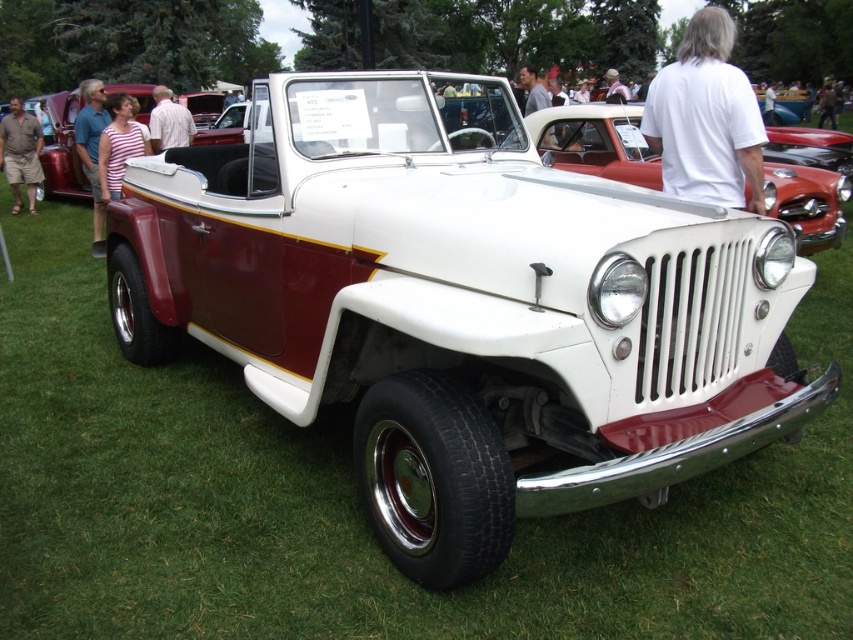
Measure the distance between point (749, 172) and camera.

Point (749, 172) and camera are 14.17 feet apart.

Between white cotton shirt at upper right and brown shorts at lower left, which one has more height?

Standing taller between the two is brown shorts at lower left.

At what (x,y) coordinates should I click in order to perform the action: click on white cotton shirt at upper right. Please return your answer as a coordinate pair (x, y). Looking at the image, I should click on (706, 118).

This screenshot has height=640, width=853. In order to click on white cotton shirt at upper right in this screenshot , I will do `click(706, 118)`.

Who is lower down, brown shorts at lower left or white cotton shirt at center?

Positioned lower is brown shorts at lower left.

Is point (28, 132) positioned after point (190, 132)?

Yes, point (28, 132) is behind point (190, 132).

Locate an element on the screen. This screenshot has height=640, width=853. brown shorts at lower left is located at coordinates (20, 154).

Image resolution: width=853 pixels, height=640 pixels. What are the coordinates of `brown shorts at lower left` in the screenshot? It's located at (20, 154).

Is white matte jeep at center thinner than blue shirt at left?

In fact, white matte jeep at center might be wider than blue shirt at left.

Can you confirm if white matte jeep at center is positioned to the left of blue shirt at left?

Incorrect, white matte jeep at center is not on the left side of blue shirt at left.

Who is more distant from viewer, [596,128] or [74,136]?

The point [74,136] is more distant.

Where is `white matte jeep at center`? This screenshot has width=853, height=640. white matte jeep at center is located at coordinates (595, 141).